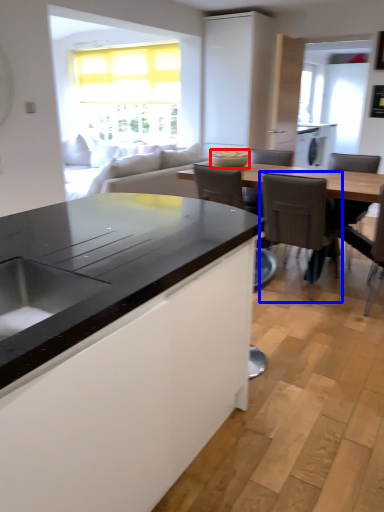
Question: Which object appears closest to the camera in this image, appliance (highlighted by a red box) or chair (highlighted by a blue box)?

Choices:
 (A) appliance
 (B) chair

Answer: (B)